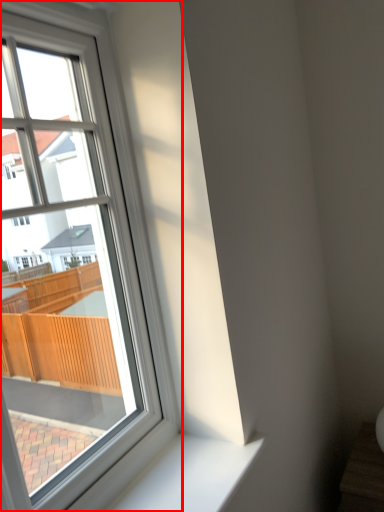
Question: From the image, what is the correct spatial relationship of window (annotated by the red box) in relation to window sill?

Choices:
 (A) left
 (B) right

Answer: (A)